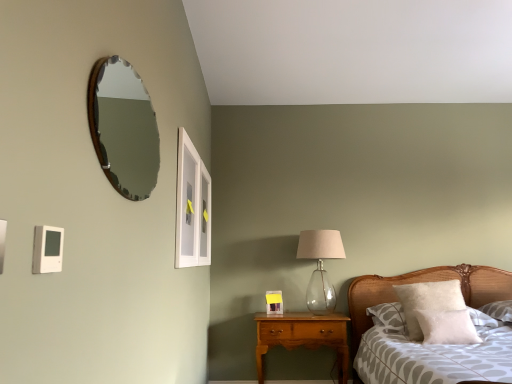
The width and height of the screenshot is (512, 384). I want to click on vacant space to the right of matte white picture frame at center, so click(x=296, y=313).